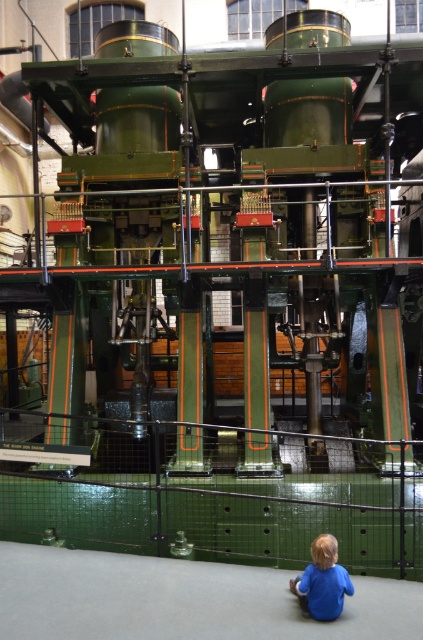
You are a museum visitor who wants to take a photo of the green polished metal steam engine at center and the blue matte shirt at lower center together in the frame. Based on their sizes, will the steam engine appear smaller than the shirt in the photo?

The green polished metal steam engine at center occupies less space than blue matte shirt at lower center, so yes, the steam engine will appear smaller than the shirt in the photo.

You are a museum visitor who wants to take a photo of the green polished metal steam engine at center and the blue matte shirt at lower center together in the frame. Based on their heights, will the steam engine appear taller than the shirt in the photo?

The green polished metal steam engine at center is not as tall as blue matte shirt at lower center, so in the photo, the blue matte shirt at lower center will appear taller than the green polished metal steam engine at center.

You are a tour guide explaining the steam engine to a visitor. The visitor asks, which object is closer to the front of the image between the green polished metal steam engine at center and the blue matte shirt at lower center? Please explain using the spatial relationship between them.

The green polished metal steam engine at center is closer to the front of the image. The blue matte shirt at lower center is positioned behind it, indicating that the engine is in front.